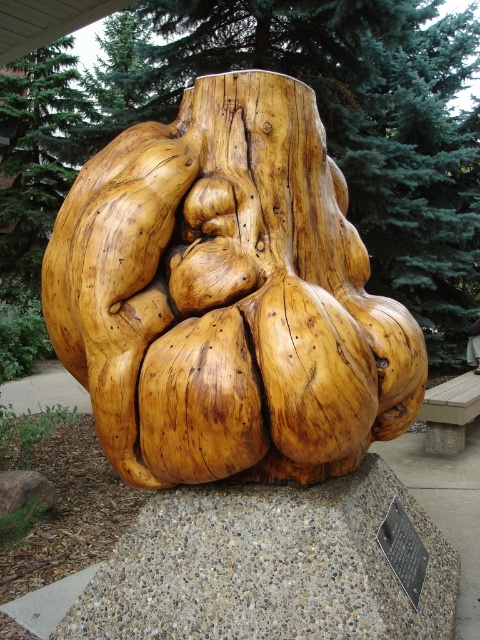
Is natural wood sculpture at center thinner than wooden bench at center?

No, natural wood sculpture at center is not thinner than wooden bench at center.

Which is above, natural wood sculpture at center or wooden bench at center?

natural wood sculpture at center is higher up.

Is point (132, 212) behind point (433, 436)?

No, (132, 212) is in front of (433, 436).

You are a GUI agent. You are given a task and a screenshot of the screen. Output one action in this format:
    pyautogui.click(x=<x>, y=<y>)
    Task: Click on the natural wood sculpture at center
    
    Given the screenshot: What is the action you would take?
    pyautogui.click(x=227, y=296)